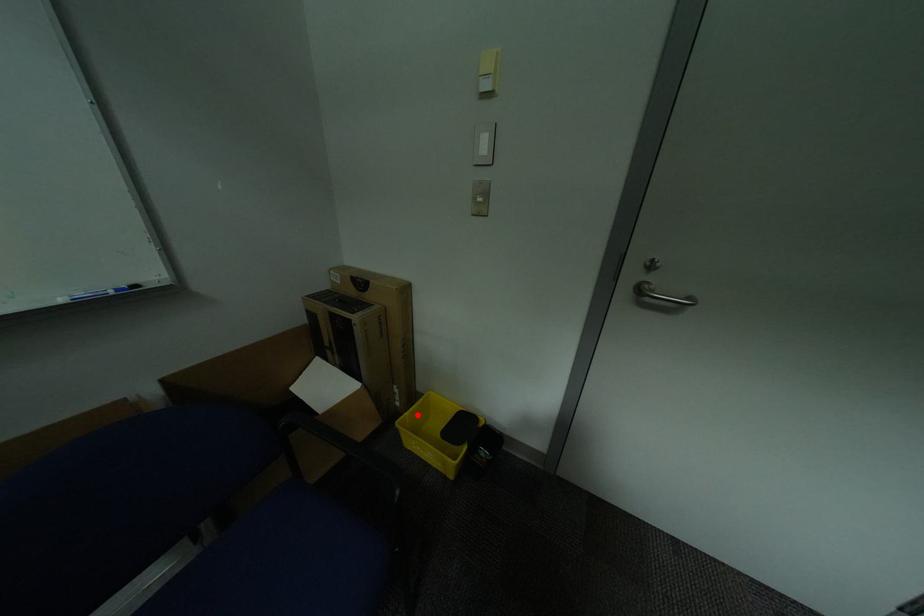
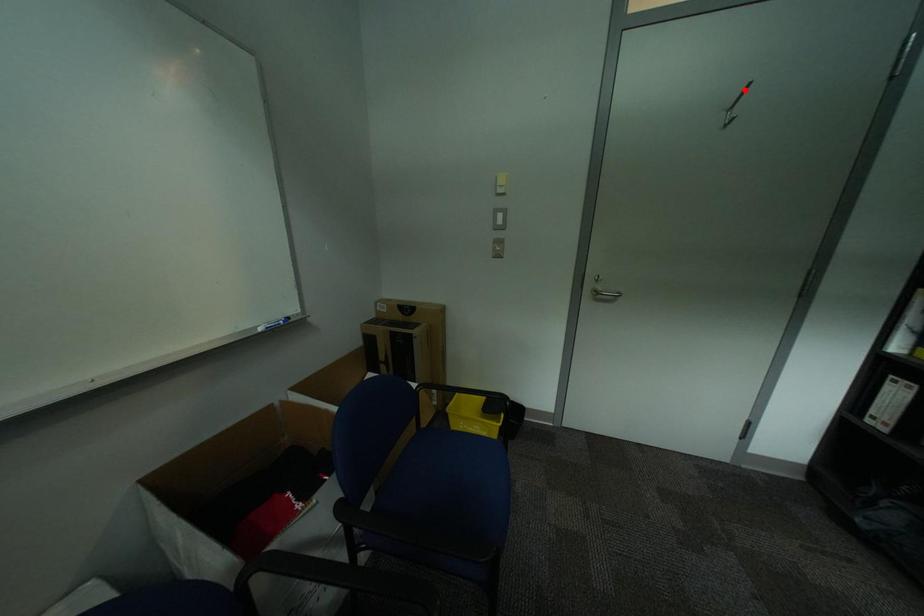
I am providing you with two images of the same scene from different viewpoints. A red point is marked on the first image and another point is marked on the second image. Are the points marked in image1 and image2 representing the same 3D position?

No